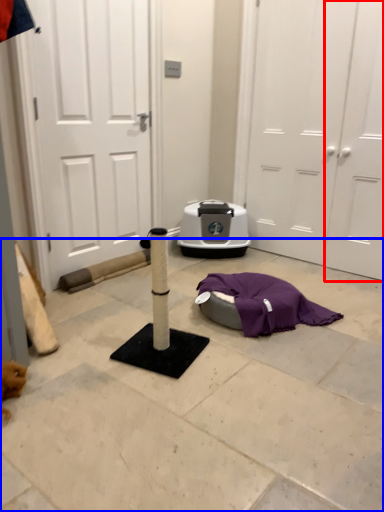
Question: Among these objects, which one is nearest to the camera, door (highlighted by a red box) or concrete (highlighted by a blue box)?

Choices:
 (A) door
 (B) concrete

Answer: (B)